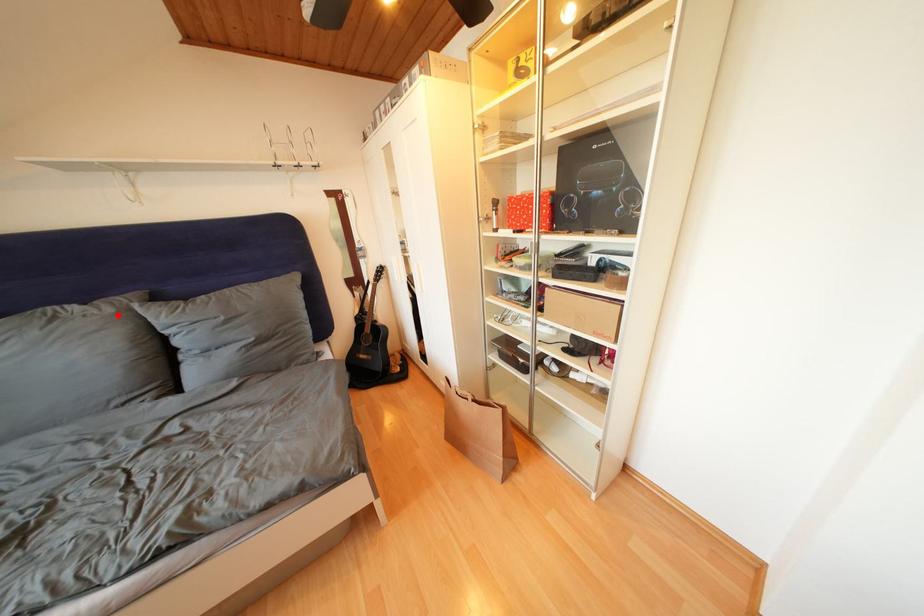
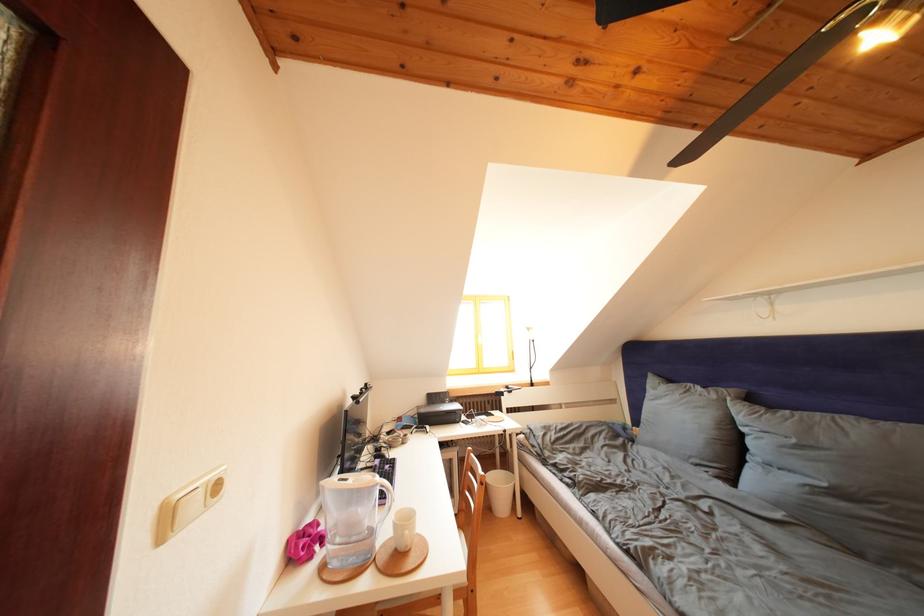
Find the pixel in the second image that matches the highlighted location in the first image.

(722, 402)